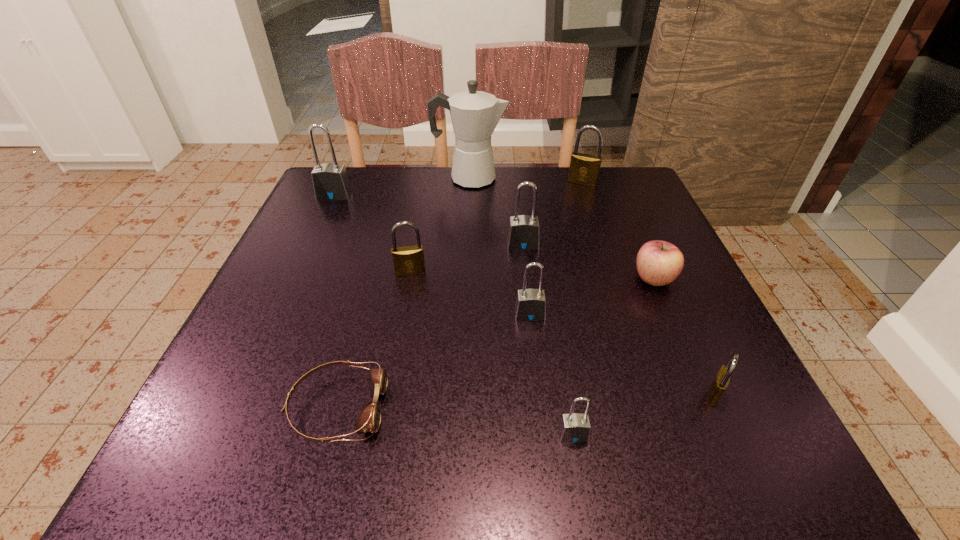
Find the location of a particular element. This screenshot has width=960, height=540. goggles that is positioned at the near edge is located at coordinates (369, 419).

Where is `padlock that is positioned at the left edge`? The image size is (960, 540). padlock that is positioned at the left edge is located at coordinates (330, 181).

Where is `goggles positioned at the left edge`? goggles positioned at the left edge is located at coordinates (369, 419).

I want to click on apple present at the right edge, so click(659, 263).

You are a GUI agent. You are given a task and a screenshot of the screen. Output one action in this format:
    pyautogui.click(x=<x>, y=<y>)
    Task: Click on the object that is at the far left corner
    The image size is (960, 540).
    Given the screenshot: What is the action you would take?
    pyautogui.click(x=330, y=181)

Where is `object located at the near left corner`? This screenshot has width=960, height=540. object located at the near left corner is located at coordinates (369, 419).

Find the location of a particular element. Image resolution: width=960 pixels, height=540 pixels. object that is at the far right corner is located at coordinates (584, 169).

This screenshot has width=960, height=540. Find the location of `free point at the far edge`. free point at the far edge is located at coordinates (437, 170).

I want to click on vacant space at the left edge, so click(x=324, y=222).

Identify the location of free space at the right edge. The width and height of the screenshot is (960, 540). (661, 398).